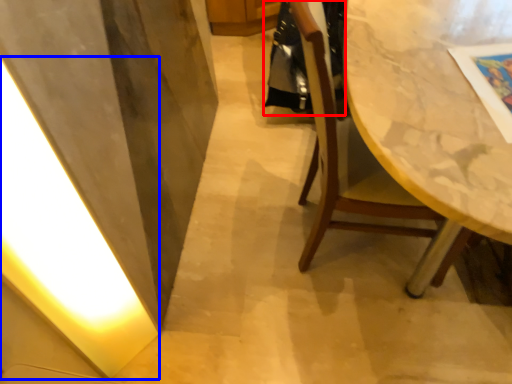
Question: Among these objects, which one is farthest to the camera, robe (highlighted by a red box) or light (highlighted by a blue box)?

Choices:
 (A) robe
 (B) light

Answer: (A)